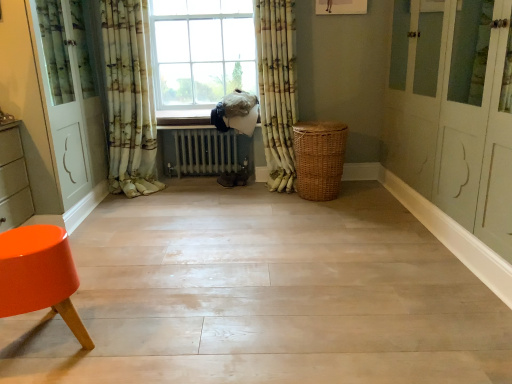
Question: From a real-world perspective, is wooden at center on top of green floral fabric curtain at left, marked as the 1th curtain in a left-to-right arrangement?

Choices:
 (A) no
 (B) yes

Answer: (A)

Question: Is wooden at center not within green floral fabric curtain at left, which appears as the 3th curtain when viewed from the right?

Choices:
 (A) yes
 (B) no

Answer: (A)

Question: Is wooden at center to the left of green floral fabric curtain at left, which appears as the 3th curtain when viewed from the right, from the viewer's perspective?

Choices:
 (A) yes
 (B) no

Answer: (B)

Question: Could green floral fabric curtain at left, which appears as the 3th curtain when viewed from the right, be considered to be inside wooden at center?

Choices:
 (A) yes
 (B) no

Answer: (B)

Question: Does wooden at center come in front of green floral fabric curtain at left, marked as the 1th curtain in a left-to-right arrangement?

Choices:
 (A) no
 (B) yes

Answer: (A)

Question: Is wooden at center facing away from green floral fabric curtain at left, marked as the 1th curtain in a left-to-right arrangement?

Choices:
 (A) no
 (B) yes

Answer: (A)

Question: Can orange glossy stool at lower left be found inside wooden at center?

Choices:
 (A) yes
 (B) no

Answer: (B)

Question: Does wooden at center have a smaller size compared to orange glossy stool at lower left?

Choices:
 (A) no
 (B) yes

Answer: (B)

Question: From a real-world perspective, is wooden at center over orange glossy stool at lower left?

Choices:
 (A) yes
 (B) no

Answer: (A)

Question: Does wooden at center have a lesser height compared to orange glossy stool at lower left?

Choices:
 (A) no
 (B) yes

Answer: (B)

Question: From the image's perspective, is wooden at center below orange glossy stool at lower left?

Choices:
 (A) yes
 (B) no

Answer: (B)

Question: Can you confirm if wooden at center is positioned to the right of orange glossy stool at lower left?

Choices:
 (A) yes
 (B) no

Answer: (A)

Question: Is orange glossy stool at lower left completely or partially outside of patterned fabric curtain at center, which is counted as the 1th curtain, starting from the right?

Choices:
 (A) no
 (B) yes

Answer: (B)